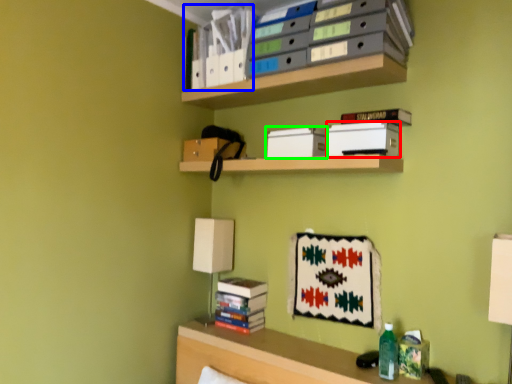
Question: Which object is the closest to the paperback book (highlighted by a red box)? Choose among these: book (highlighted by a blue box) or paperback book (highlighted by a green box).

Choices:
 (A) book
 (B) paperback book

Answer: (B)